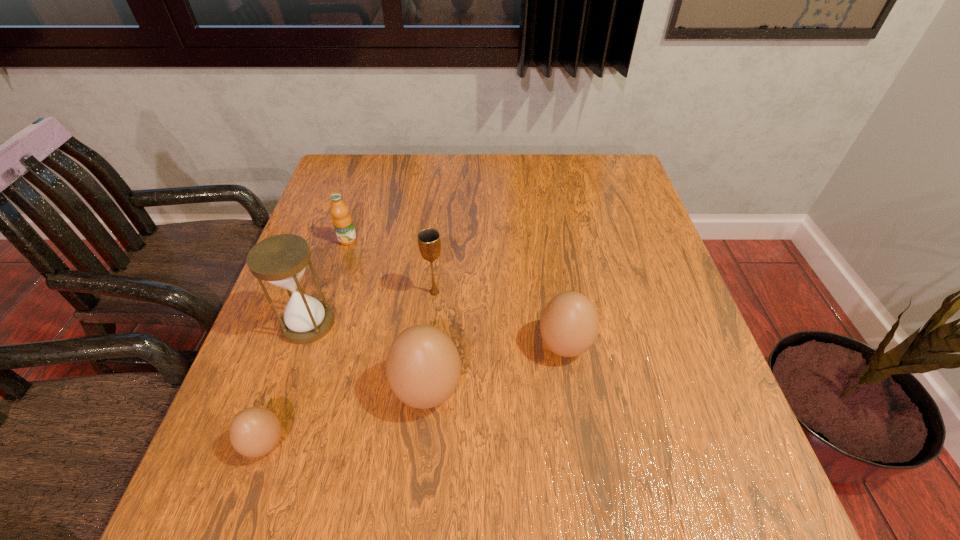
In order to click on blank area in the image that satisfies the following two spatial constraints: 1. on the label of the second tallest boiled egg; 2. on the right side of the farthest object in this screenshot , I will do `click(315, 346)`.

Image resolution: width=960 pixels, height=540 pixels. In order to click on free space that satisfies the following two spatial constraints: 1. on the front side of the second boiled egg from left to right; 2. on the right side of the tallest object in this screenshot , I will do `click(285, 390)`.